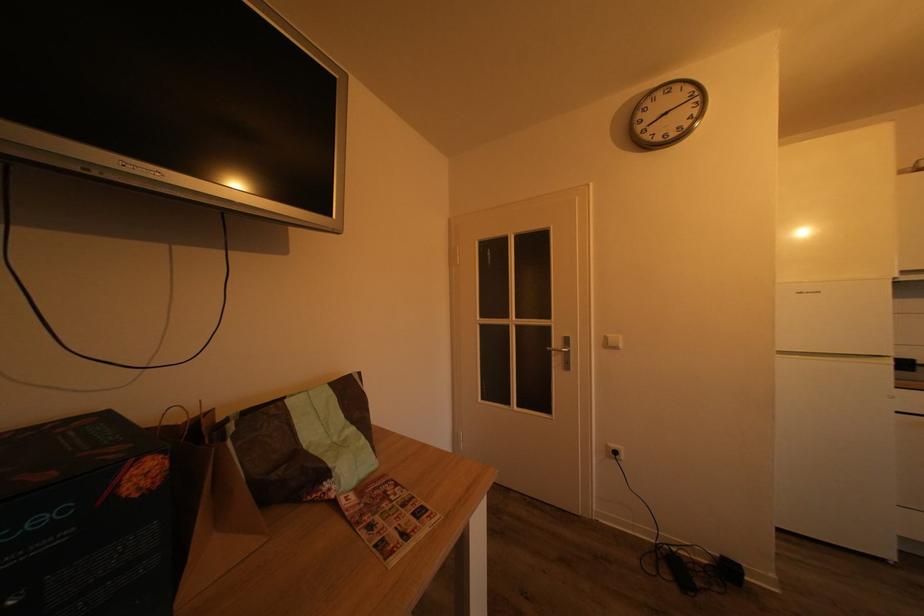
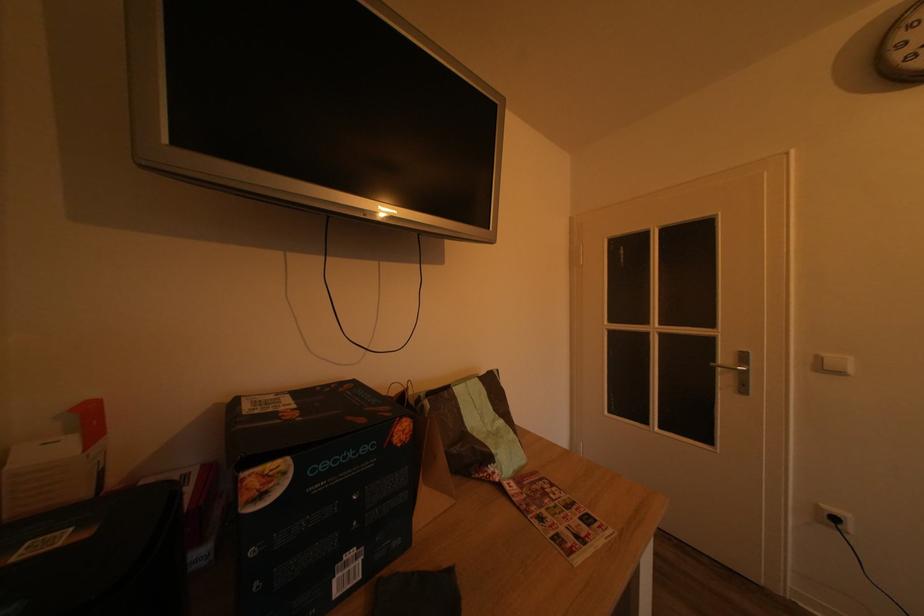
In the second image, find the point that corresponds to point (624, 459) in the first image.

(843, 525)